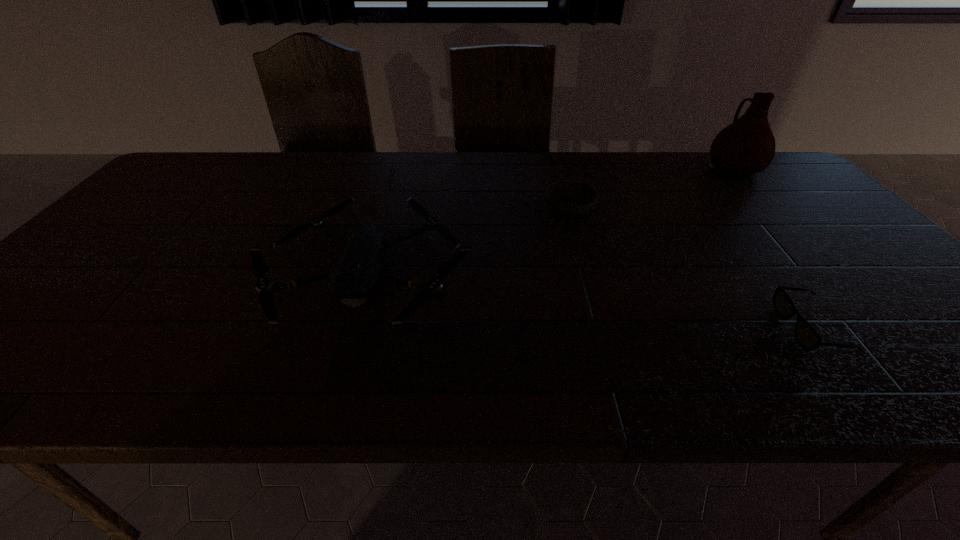
The image size is (960, 540). In order to click on object present at the far edge in this screenshot , I will do `click(747, 146)`.

The height and width of the screenshot is (540, 960). I want to click on drone that is at the near edge, so coord(355,275).

Where is `sunglasses present at the near edge`? The image size is (960, 540). sunglasses present at the near edge is located at coordinates (807, 337).

Locate an element on the screen. object at the right edge is located at coordinates (747, 146).

Where is `object that is at the far right corner`? object that is at the far right corner is located at coordinates (747, 146).

Identify the location of free space at the far edge of the desktop. (417, 157).

In the image, there is a desktop. Find the location of `vacant space at the near edge`. vacant space at the near edge is located at coordinates (604, 367).

Identify the location of free region at the left edge of the desktop. (121, 232).

Where is `free space at the right edge`? free space at the right edge is located at coordinates (906, 350).

The image size is (960, 540). In order to click on free space at the near right corner of the desktop in this screenshot , I will do `click(934, 358)`.